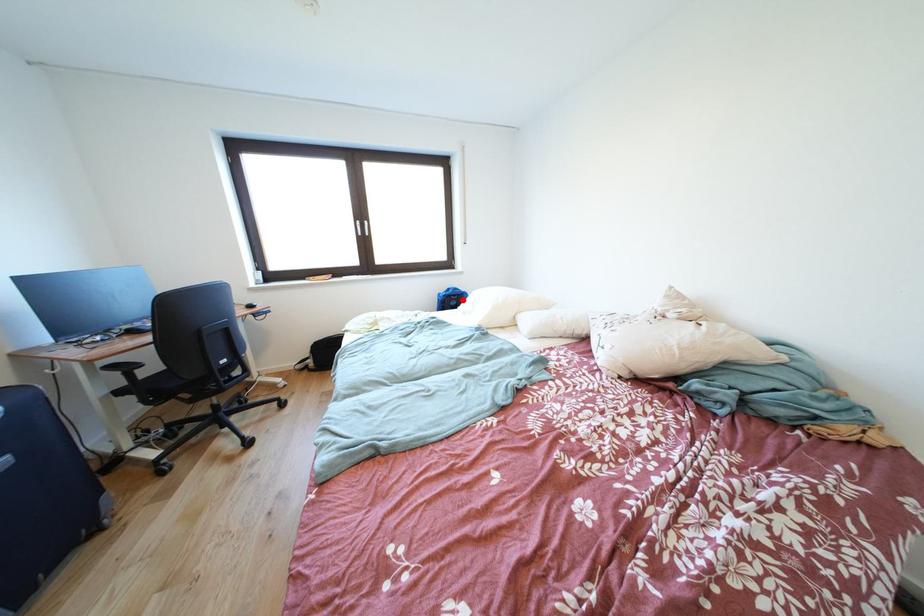
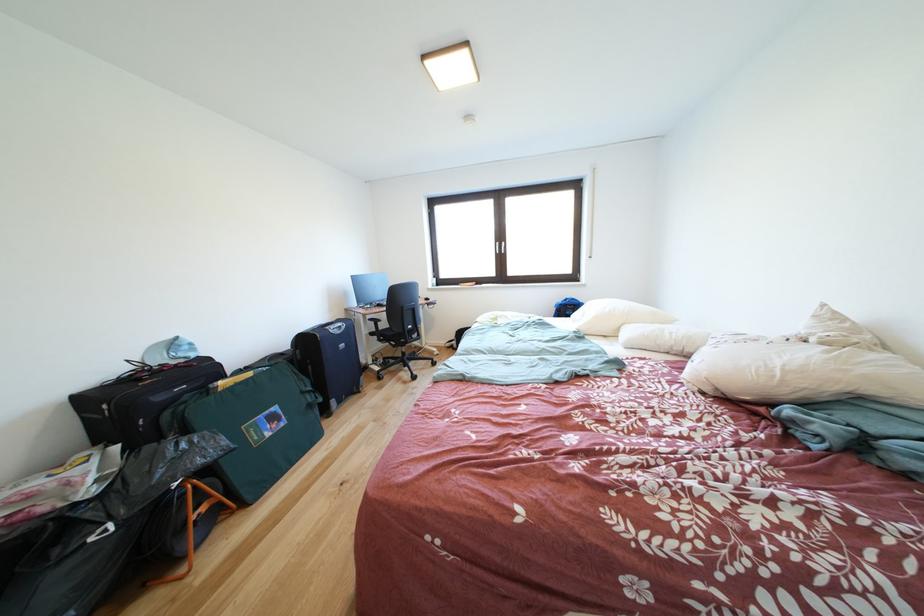
Locate, in the second image, the point that corresponds to the highlighted location in the first image.

(578, 310)